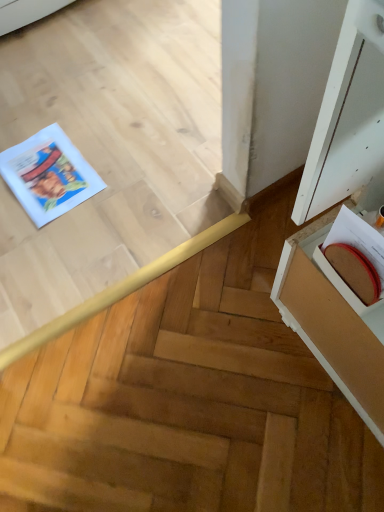
Question: Is white wood cabinet at right inside the boundaries of matte brown book at right, or outside?

Choices:
 (A) inside
 (B) outside

Answer: (B)

Question: Does point (355, 116) appear closer or farther from the camera than point (375, 245)?

Choices:
 (A) closer
 (B) farther

Answer: (A)

Question: Considering the real-world distances, which object is farthest from the matte brown book at right?

Choices:
 (A) white paper comic book at left
 (B) white wood cabinet at right

Answer: (A)

Question: Estimate the real-world distances between objects in this image. Which object is farther from the white wood cabinet at right?

Choices:
 (A) matte brown book at right
 (B) white paper comic book at left

Answer: (B)